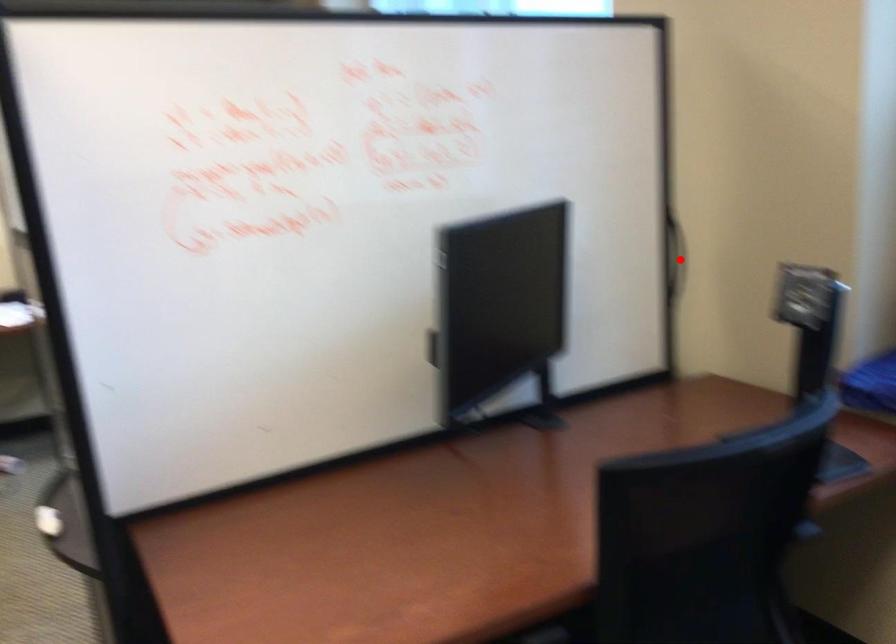
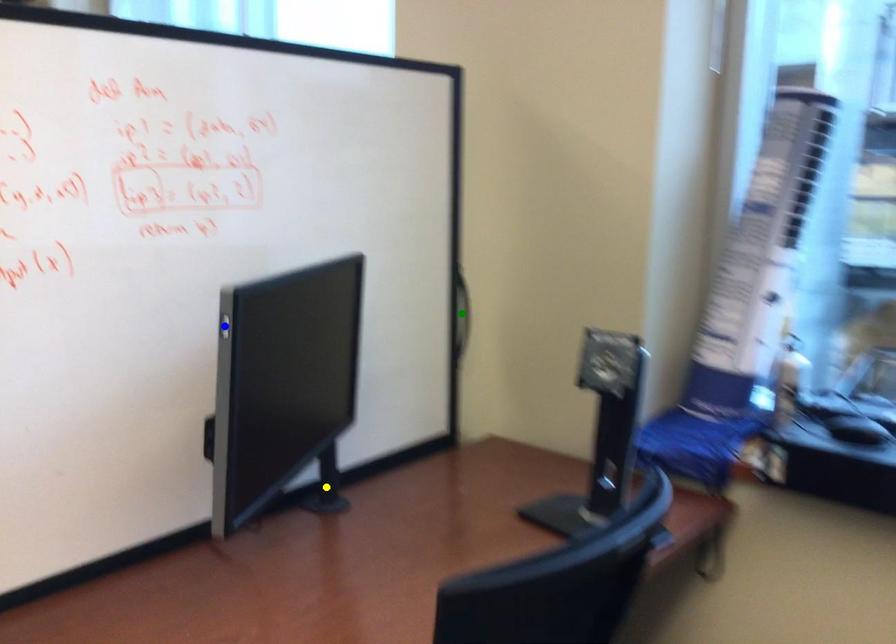
Question: I am providing you with two images of the same scene from different viewpoints. A red point is marked on the first image. You are given multiple points on the second image. Which point in image 2 is actually the same real-world point as the red point in image 1?

Choices:
 (A) yellow point
 (B) green point
 (C) blue point

Answer: (B)